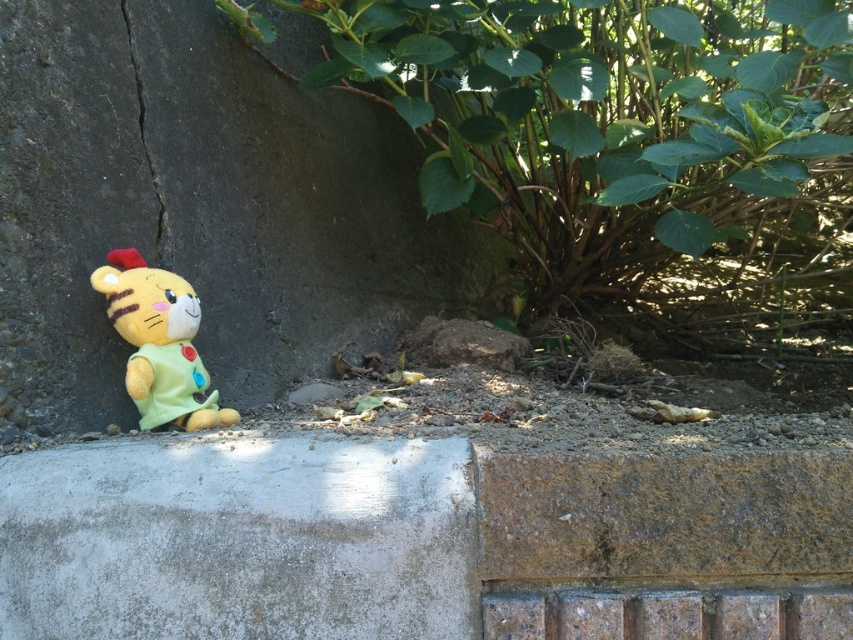
Question: Which of the following is the farthest from the observer?

Choices:
 (A) black concrete crack at left
 (B) gray concrete at lower left
 (C) soft plush cat at lower left
 (D) green leafy bush at center

Answer: (A)

Question: Is soft plush cat at lower left to the left of black concrete crack at left from the viewer's perspective?

Choices:
 (A) no
 (B) yes

Answer: (A)

Question: Based on their relative distances, which object is farther from the gray concrete at lower left?

Choices:
 (A) green leafy bush at center
 (B) smooth concrete wall at lower left
 (C) black concrete crack at left
 (D) soft plush cat at lower left

Answer: (A)

Question: Does green leafy bush at center appear on the left side of black concrete crack at left?

Choices:
 (A) yes
 (B) no

Answer: (B)

Question: Which of the following is the closest to the observer?

Choices:
 (A) black concrete crack at left
 (B) soft plush cat at lower left

Answer: (B)

Question: Does smooth concrete wall at lower left appear on the left side of black concrete crack at left?

Choices:
 (A) yes
 (B) no

Answer: (B)